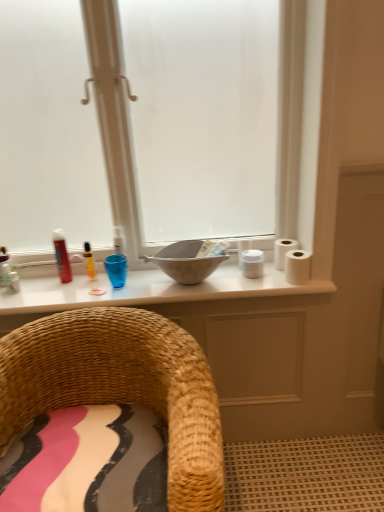
Where is `free spot to the left of white matte toilet paper at right, arranged as the 2th toilet paper when viewed from the back`? This screenshot has width=384, height=512. free spot to the left of white matte toilet paper at right, arranged as the 2th toilet paper when viewed from the back is located at coordinates (259, 282).